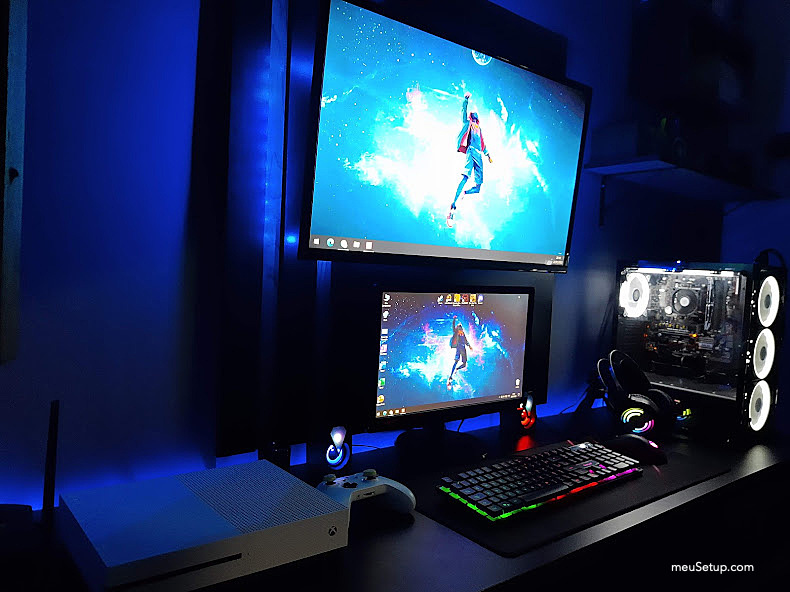
This screenshot has height=592, width=790. What are the coordinates of `wall` in the screenshot? It's located at (100, 143).